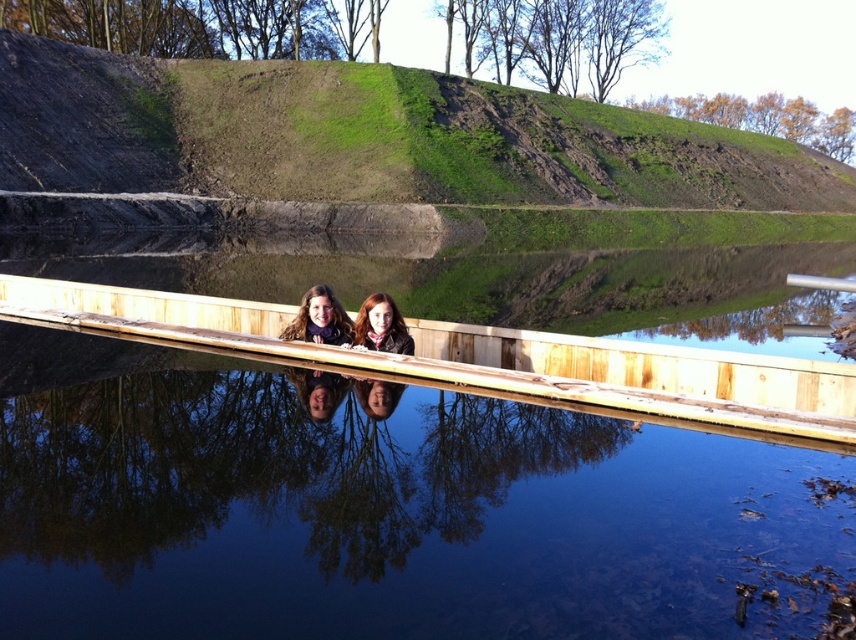
Between wooden ledge at center and matte brown scarf at center, which one has more height?

wooden ledge at center

Can you confirm if wooden ledge at center is smaller than matte brown scarf at center?

Actually, wooden ledge at center might be larger than matte brown scarf at center.

Who is more forward, (727, 358) or (367, 340)?

Point (727, 358)

Locate an element on the screen. wooden ledge at center is located at coordinates (486, 356).

Can you confirm if matte purple sweater at center is positioned below matte brown scarf at center?

Incorrect, matte purple sweater at center is not positioned below matte brown scarf at center.

Is matte purple sweater at center shorter than matte brown scarf at center?

Indeed, matte purple sweater at center has a lesser height compared to matte brown scarf at center.

Between point (314, 337) and point (388, 349), which one is positioned behind?

The point (314, 337) is behind.

The image size is (856, 640). In order to click on matte purple sweater at center in this screenshot , I will do `click(321, 317)`.

Measure the distance between point (78, 323) and camera.

9.80 meters

Who is higher up, wooden ledge at center or matte purple sweater at center?

matte purple sweater at center is above.

Which is in front, point (278, 346) or point (316, 296)?

Point (316, 296)

Where is `wooden ledge at center`? This screenshot has height=640, width=856. wooden ledge at center is located at coordinates click(486, 356).